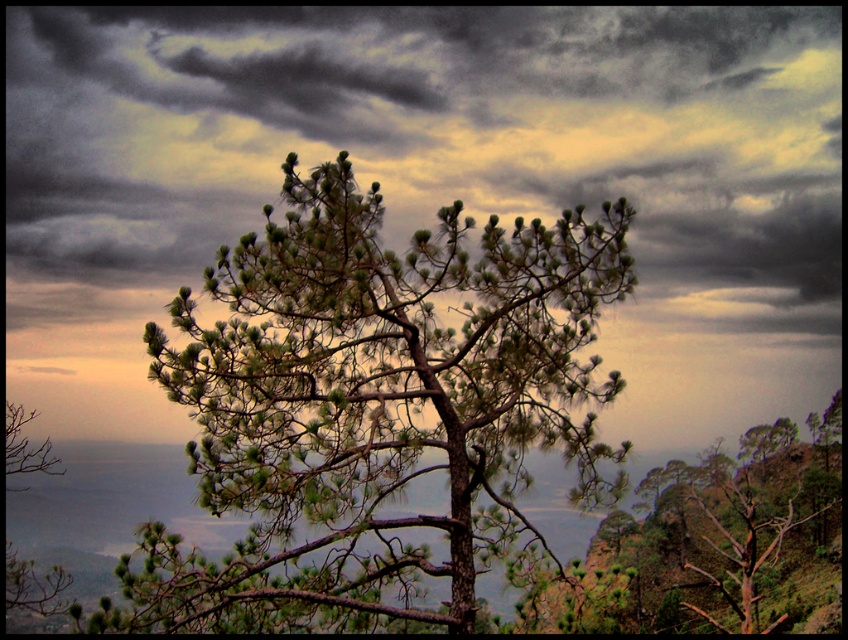
Consider the image. Which of these two, dark gray cloud at upper center or green needle-like at center, stands taller?

With more height is dark gray cloud at upper center.

Does dark gray cloud at upper center appear under green needle-like at center?

No, dark gray cloud at upper center is not below green needle-like at center.

The width and height of the screenshot is (848, 640). Find the location of `dark gray cloud at upper center`. dark gray cloud at upper center is located at coordinates (427, 141).